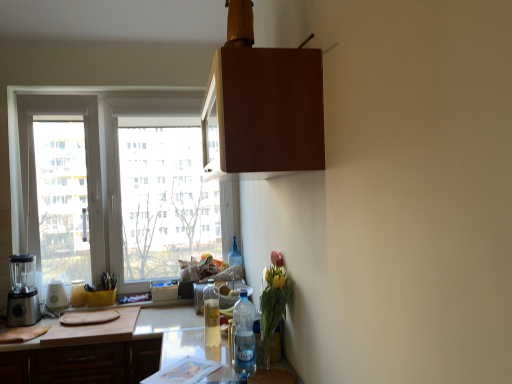
Question: From the image's perspective, would you say clear plastic bottle at lower center, the 4th bottle in the back-to-front sequence, is shown under clear plastic bottle at center, which ranks as the third appliance in left-to-right order?

Choices:
 (A) yes
 (B) no

Answer: (B)

Question: Is clear plastic bottle at lower center, the 4th bottle in the back-to-front sequence, outside of clear plastic bottle at center, which ranks as the third appliance in left-to-right order?

Choices:
 (A) no
 (B) yes

Answer: (B)

Question: From a real-world perspective, does clear plastic bottle at lower center, the 1th bottle from the right, sit lower than clear plastic bottle at center, which appears as the 1th appliance when viewed from the right?

Choices:
 (A) no
 (B) yes

Answer: (A)

Question: Could you tell me if clear plastic bottle at lower center, the 4th bottle in the back-to-front sequence, is turned towards clear plastic bottle at center, which ranks as the third appliance in left-to-right order?

Choices:
 (A) yes
 (B) no

Answer: (B)

Question: From the image's perspective, would you say clear plastic bottle at lower center, the 1th bottle from the right, is positioned over clear plastic bottle at center, which ranks as the third appliance in left-to-right order?

Choices:
 (A) no
 (B) yes

Answer: (B)

Question: In terms of width, does brown matte cabinet at upper center, the second cabinetry ordered from the bottom, look wider or thinner when compared to white plastic toaster at left, marked as the 2th appliance in a right-to-left arrangement?

Choices:
 (A) thin
 (B) wide

Answer: (B)

Question: From their relative heights in the image, would you say brown matte cabinet at upper center, placed as the first cabinetry when sorted from top to bottom, is taller or shorter than white plastic toaster at left, which ranks as the 2th appliance in left-to-right order?

Choices:
 (A) short
 (B) tall

Answer: (B)

Question: Would you say brown matte cabinet at upper center, placed as the first cabinetry when sorted from top to bottom, is to the left or to the right of white plastic toaster at left, which ranks as the 2th appliance in left-to-right order, in the picture?

Choices:
 (A) left
 (B) right

Answer: (B)

Question: In terms of size, does brown matte cabinet at upper center, the 2th cabinetry viewed from the left, appear bigger or smaller than white plastic toaster at left, which ranks as the 2th appliance in left-to-right order?

Choices:
 (A) small
 (B) big

Answer: (B)

Question: From the image's perspective, relative to wooden cutting board at lower left, the first cabinetry from the back, is clear plastic bottle at lower center, which is the first bottle in front-to-back order, above or below?

Choices:
 (A) above
 (B) below

Answer: (A)

Question: Is clear plastic bottle at lower center, which is the 4th bottle in left-to-right order, bigger or smaller than wooden cutting board at lower left, marked as the 2th cabinetry in a top-to-bottom arrangement?

Choices:
 (A) small
 (B) big

Answer: (A)

Question: Considering the positions of point (251, 317) and point (145, 339), is point (251, 317) closer or farther from the camera than point (145, 339)?

Choices:
 (A) farther
 (B) closer

Answer: (B)

Question: From a real-world perspective, relative to wooden cutting board at lower left, which is counted as the 1th cabinetry, starting from the left, is clear plastic bottle at lower center, the 4th bottle in the back-to-front sequence, vertically above or below?

Choices:
 (A) below
 (B) above

Answer: (B)

Question: Is satin silver blender at left, positioned as the 1th appliance in left-to-right order, inside the boundaries of translucent glass bottle at lower left, positioned as the 1th bottle in left-to-right order, or outside?

Choices:
 (A) outside
 (B) inside

Answer: (A)

Question: Is satin silver blender at left, positioned as the 1th appliance in left-to-right order, wider or thinner than translucent glass bottle at lower left, positioned as the 1th bottle in left-to-right order?

Choices:
 (A) wide
 (B) thin

Answer: (A)